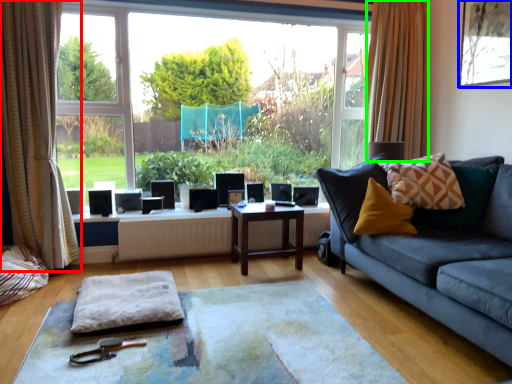
Question: Based on their relative distances, which object is nearer to curtain (highlighted by a red box)? Choose from picture frame (highlighted by a blue box) and curtain (highlighted by a green box).

Choices:
 (A) picture frame
 (B) curtain

Answer: (B)